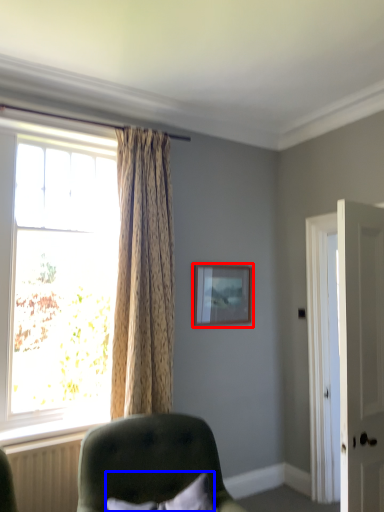
Question: Which object is closer to the camera taking this photo, picture frame (highlighted by a red box) or pillow (highlighted by a blue box)?

Choices:
 (A) picture frame
 (B) pillow

Answer: (B)